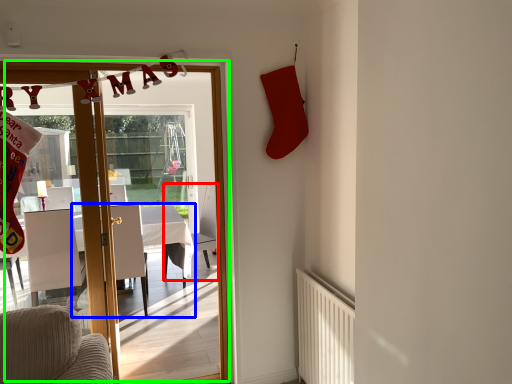
Question: Which object is positioned closest to armchair (highlighted by a red box)? Select from table (highlighted by a blue box) and door (highlighted by a green box).

Choices:
 (A) table
 (B) door

Answer: (A)